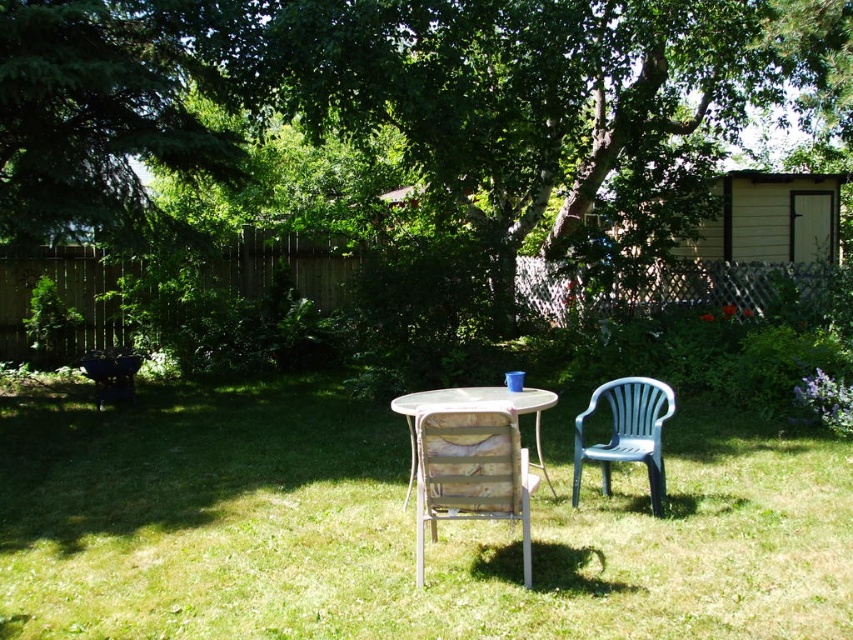
You are planning to place a large garden statue that requires a 2x2 meter space. Based on the scene, which object between the green grass at center and the green leafy tree at center would be more suitable for placing the statue?

The green grass at center is smaller than the green leafy tree at center, so the green grass at center may not provide enough space for the statue. The green leafy tree at center is larger and might have more space around it to accommodate the statue.

You are standing at the center of the backyard. Where is the wooden slatted chair at center located in relation to your position?

The wooden slatted chair at center is located at point 0.736 on the x axis and 0.552 on the y axis relative to your position at the center of the backyard.

You are a gardener who needs to water the green grass at center and the wooden table at center. If your watering can holds enough water for 3 meters of distance, can you water both areas without needing to refill?

The green grass at center is 2.07 meters away from wooden table at center. Since the total distance between them is within the 3 meters capacity of the watering can, you can water both areas without refilling.